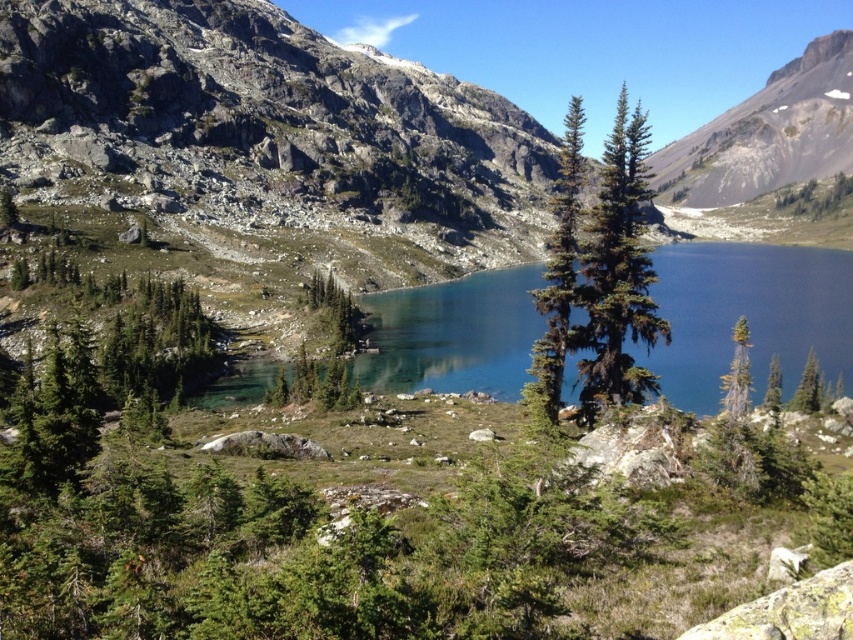
Question: Can you confirm if green needle-like tree at center is thinner than green matte tree at center-right?

Choices:
 (A) yes
 (B) no

Answer: (B)

Question: Which point is closer to the camera?

Choices:
 (A) clear glass water at center
 (B) green textured pine tree at center right
 (C) green matte tree at center-right
 (D) green needle-like tree at center

Answer: (B)

Question: Can you confirm if clear glass water at center is positioned below green matte tree at right?

Choices:
 (A) yes
 (B) no

Answer: (B)

Question: Which object is positioned closest to the green matte tree at center-right?

Choices:
 (A) green matte tree at center
 (B) green matte tree at right
 (C) green textured pine tree at center right

Answer: (B)

Question: Which object is the closest to the green matte tree at center-right?

Choices:
 (A) green matte tree at center
 (B) green textured tree at center
 (C) green textured pine tree at center right
 (D) rugged granite mountain at upper center

Answer: (B)

Question: Is clear glass water at center behind green matte tree at right?

Choices:
 (A) yes
 (B) no

Answer: (B)